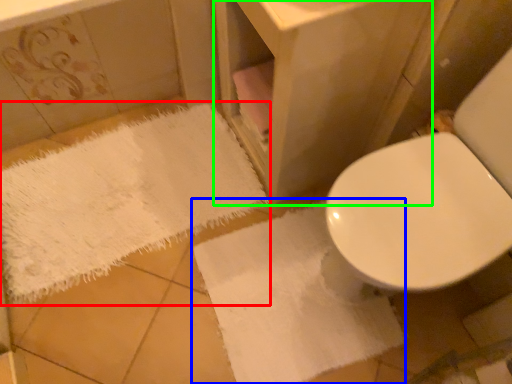
Question: Based on their relative distances, which object is farther from bath towel (highlighted by a red box)? Choose from bath towel (highlighted by a blue box) and vanity (highlighted by a green box).

Choices:
 (A) bath towel
 (B) vanity

Answer: (B)